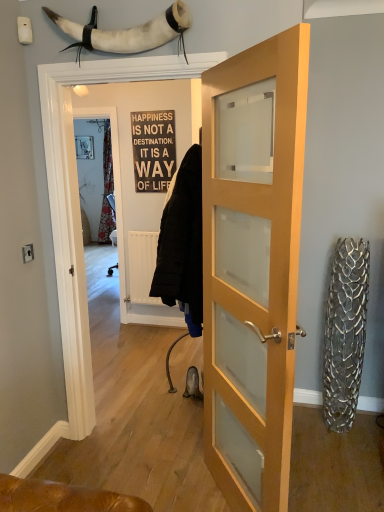
Find the location of a particular element. The height and width of the screenshot is (512, 384). white wood sign at center is located at coordinates (153, 149).

The image size is (384, 512). What do you see at coordinates (127, 32) in the screenshot?
I see `white leather horn at upper center` at bounding box center [127, 32].

What is the approximate height of wooden door at center, acting as the 2th door starting from the right?

wooden door at center, acting as the 2th door starting from the right, is 2.09 meters in height.

Identify the location of light wood/glass door at center, acting as the 2th door starting from the left. This screenshot has height=512, width=384. (253, 275).

Is wooden door at center, acting as the 2th door starting from the right, taller or shorter than white leather horn at upper center?

Clearly, wooden door at center, acting as the 2th door starting from the right, is taller compared to white leather horn at upper center.

Based on their sizes in the image, would you say wooden door at center, acting as the 2th door starting from the right, is bigger or smaller than white leather horn at upper center?

Considering their sizes, wooden door at center, acting as the 2th door starting from the right, takes up more space than white leather horn at upper center.

Between wooden door at center, acting as the 2th door starting from the right, and white leather horn at upper center, which one has smaller width?

white leather horn at upper center is thinner.

This screenshot has width=384, height=512. Find the location of `animal above the wooden door at center, acting as the 2th door starting from the right (from the image's perspective)`. animal above the wooden door at center, acting as the 2th door starting from the right (from the image's perspective) is located at coordinates (127, 32).

Is white wood sign at center facing towards white leather horn at upper center?

Yes, white wood sign at center is facing white leather horn at upper center.

Is white wood sign at center bigger or smaller than white leather horn at upper center?

white wood sign at center is smaller than white leather horn at upper center.

Looking at this image, does white wood sign at center have a greater height compared to white leather horn at upper center?

Yes.

Between wooden door at center, acting as the 2th door starting from the right, and light wood/glass door at center, acting as the 2th door starting from the left, which one appears on the right side from the viewer's perspective?

light wood/glass door at center, acting as the 2th door starting from the left.

In order to click on door directly beneath the wooden door at center, acting as the 2th door starting from the right (from a real-world perspective) in this screenshot , I will do `click(253, 275)`.

Consider the image. Which object is closer to the camera taking this photo, wooden door at center, acting as the 2th door starting from the right, or light wood/glass door at center, acting as the 2th door starting from the left?

Positioned in front is light wood/glass door at center, acting as the 2th door starting from the left.

Is wooden door at center, acting as the 2th door starting from the right, inside the boundaries of light wood/glass door at center, acting as the 2th door starting from the left, or outside?

wooden door at center, acting as the 2th door starting from the right, cannot be found inside light wood/glass door at center, acting as the 2th door starting from the left.

Consider the image. From a real-world perspective, which object stands above the other?

white leather horn at upper center, from a real-world perspective.

From the image's perspective, is white leather horn at upper center above or below wooden door at center, arranged as the 1th door when viewed from the left?

white leather horn at upper center is above wooden door at center, arranged as the 1th door when viewed from the left.

Is white leather horn at upper center thinner than wooden door at center, arranged as the 1th door when viewed from the left?

Yes.

Can you confirm if white leather horn at upper center is smaller than white wood sign at center?

Incorrect, white leather horn at upper center is not smaller in size than white wood sign at center.

Is white leather horn at upper center in contact with white wood sign at center?

No, white leather horn at upper center is not making contact with white wood sign at center.

Measure the distance from white leather horn at upper center to white wood sign at center.

white leather horn at upper center and white wood sign at center are 1.81 meters apart.

From the picture: What's the angular difference between light wood/glass door at center, acting as the 2th door starting from the left, and white wood sign at center's facing directions?

The facing directions of light wood/glass door at center, acting as the 2th door starting from the left, and white wood sign at center are 55.5 degrees apart.

Considering the relative sizes of light wood/glass door at center, acting as the first door starting from the right, and white wood sign at center in the image provided, is light wood/glass door at center, acting as the first door starting from the right, thinner than white wood sign at center?

No, light wood/glass door at center, acting as the first door starting from the right, is not thinner than white wood sign at center.

Can you confirm if light wood/glass door at center, acting as the 2th door starting from the left, is positioned to the right of white wood sign at center?

Yes.

Which object is further away from the camera taking this photo, light wood/glass door at center, acting as the 2th door starting from the left, or white wood sign at center?

white wood sign at center is further away from the camera.

Is white wood sign at center not within wooden door at center, acting as the 2th door starting from the right?

Absolutely, white wood sign at center is external to wooden door at center, acting as the 2th door starting from the right.

Is point (174, 148) less distant than point (153, 104)?

That is False.

Are white wood sign at center and wooden door at center, acting as the 2th door starting from the right, making contact?

No.

Considering the sizes of white wood sign at center and wooden door at center, arranged as the 1th door when viewed from the left, in the image, is white wood sign at center wider or thinner than wooden door at center, arranged as the 1th door when viewed from the left,?

In the image, white wood sign at center appears to be more narrow than wooden door at center, arranged as the 1th door when viewed from the left.

From the image's perspective, count 1st doors downward from the white leather horn at upper center and point to it. Please provide its 2D coordinates.

[(132, 159)]

This screenshot has height=512, width=384. I want to click on animal lying on the left of white wood sign at center, so click(x=127, y=32).

Looking at the image, which one is located further to light wood/glass door at center, acting as the first door starting from the right, wooden door at center, arranged as the 1th door when viewed from the left, or white leather horn at upper center?

Based on the image, wooden door at center, arranged as the 1th door when viewed from the left, appears to be further to light wood/glass door at center, acting as the first door starting from the right.

Estimate the real-world distances between objects in this image. Which object is closer to light wood/glass door at center, acting as the first door starting from the right, wooden door at center, arranged as the 1th door when viewed from the left, or white wood sign at center?

white wood sign at center is positioned closer to the anchor light wood/glass door at center, acting as the first door starting from the right.

Looking at the image, which one is located closer to white leather horn at upper center, white wood sign at center or wooden door at center, acting as the 2th door starting from the right?

The object closer to white leather horn at upper center is white wood sign at center.

When comparing their distances from white leather horn at upper center, does wooden door at center, acting as the 2th door starting from the right, or white wood sign at center seem closer?

Based on the image, white wood sign at center appears to be nearer to white leather horn at upper center.

From the image, which object appears to be nearer to white wood sign at center, wooden door at center, arranged as the 1th door when viewed from the left, or white leather horn at upper center?

The object closer to white wood sign at center is wooden door at center, arranged as the 1th door when viewed from the left.

Based on the photo, based on their spatial positions, is white wood sign at center or wooden door at center, arranged as the 1th door when viewed from the left, closer to light wood/glass door at center, acting as the first door starting from the right?

white wood sign at center is closer to light wood/glass door at center, acting as the first door starting from the right.

Looking at the image, which one is located further to wooden door at center, acting as the 2th door starting from the right, white wood sign at center or light wood/glass door at center, acting as the first door starting from the right?

Among the two, light wood/glass door at center, acting as the first door starting from the right, is located further to wooden door at center, acting as the 2th door starting from the right.

Based on their spatial positions, is white leather horn at upper center or white wood sign at center closer to wooden door at center, acting as the 2th door starting from the right?

The object closer to wooden door at center, acting as the 2th door starting from the right, is white wood sign at center.

Identify the location of animal between light wood/glass door at center, acting as the 2th door starting from the left, and white wood sign at center, along the z-axis. (127, 32).

In order to click on door positioned between light wood/glass door at center, acting as the 2th door starting from the left, and white wood sign at center from near to far in this screenshot , I will do `click(132, 159)`.

The height and width of the screenshot is (512, 384). Identify the location of door that lies between white leather horn at upper center and light wood/glass door at center, acting as the first door starting from the right, from top to bottom. (132, 159).

Find the location of a particular element. The width and height of the screenshot is (384, 512). door between white leather horn at upper center and white wood sign at center in the front-back direction is located at coordinates (132, 159).